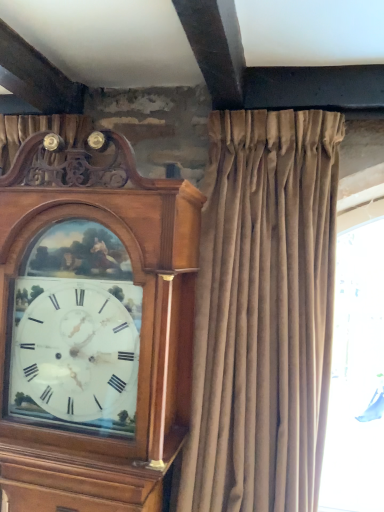
Question: Is wooden grandfather clock at left taller or shorter than velvet beige curtain at center?

Choices:
 (A) tall
 (B) short

Answer: (B)

Question: Is point (94, 470) positioned closer to the camera than point (261, 504)?

Choices:
 (A) closer
 (B) farther

Answer: (A)

Question: From the image's perspective, is wooden grandfather clock at left positioned above or below velvet beige curtain at center?

Choices:
 (A) above
 (B) below

Answer: (B)

Question: Is point (269, 126) positioned closer to the camera than point (28, 167)?

Choices:
 (A) closer
 (B) farther

Answer: (B)

Question: Is velvet beige curtain at center taller or shorter than wooden grandfather clock at left?

Choices:
 (A) tall
 (B) short

Answer: (A)

Question: Is velvet beige curtain at center situated inside wooden grandfather clock at left or outside?

Choices:
 (A) outside
 (B) inside

Answer: (A)

Question: From a real-world perspective, is velvet beige curtain at center positioned above or below wooden grandfather clock at left?

Choices:
 (A) below
 (B) above

Answer: (B)